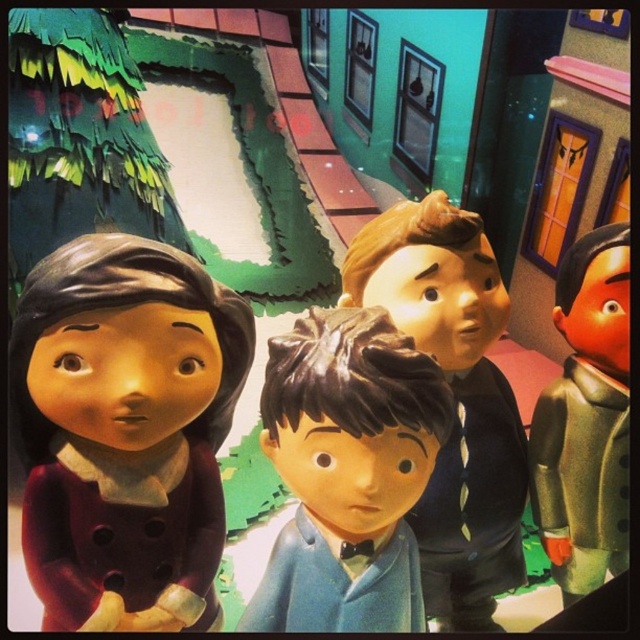
Question: Which of these objects is positioned farthest from the green matte suit at right?

Choices:
 (A) satin blue suit at center
 (B) matte brown doll at left
 (C) matte brown hair at center

Answer: (B)

Question: Is matte brown doll at left smaller than satin blue suit at center?

Choices:
 (A) no
 (B) yes

Answer: (A)

Question: Considering the relative positions of satin blue suit at center and matte brown hair at center in the image provided, where is satin blue suit at center located with respect to matte brown hair at center?

Choices:
 (A) above
 (B) below

Answer: (B)

Question: Which point is farther to the camera?

Choices:
 (A) satin blue suit at center
 (B) matte brown doll at left
 (C) matte brown hair at center

Answer: (C)

Question: Is the position of matte brown hair at center more distant than that of green matte suit at right?

Choices:
 (A) yes
 (B) no

Answer: (B)

Question: Which of these objects is positioned closest to the satin blue suit at center?

Choices:
 (A) matte brown hair at center
 (B) matte brown doll at left
 (C) green matte suit at right

Answer: (B)